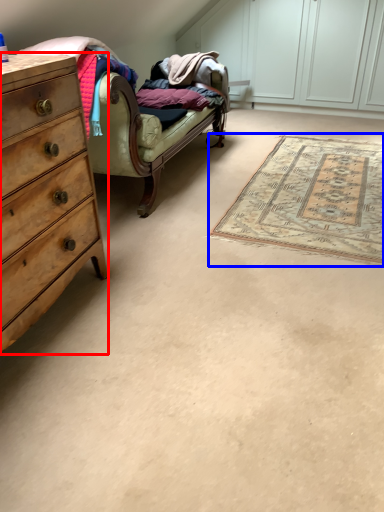
Question: Which point is closer to the camera, chest of drawers (highlighted by a red box) or mat (highlighted by a blue box)?

Choices:
 (A) chest of drawers
 (B) mat

Answer: (A)